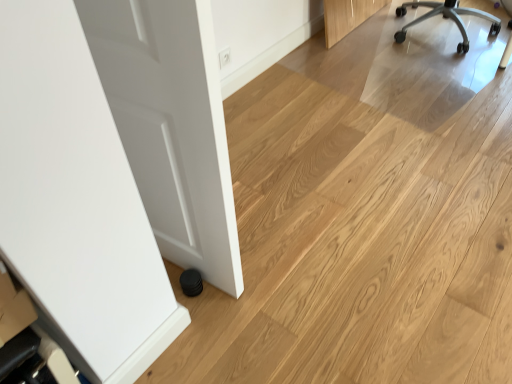
Identify the location of vacant area that is situated to the right of white glossy door at left. This screenshot has height=384, width=512. (274, 265).